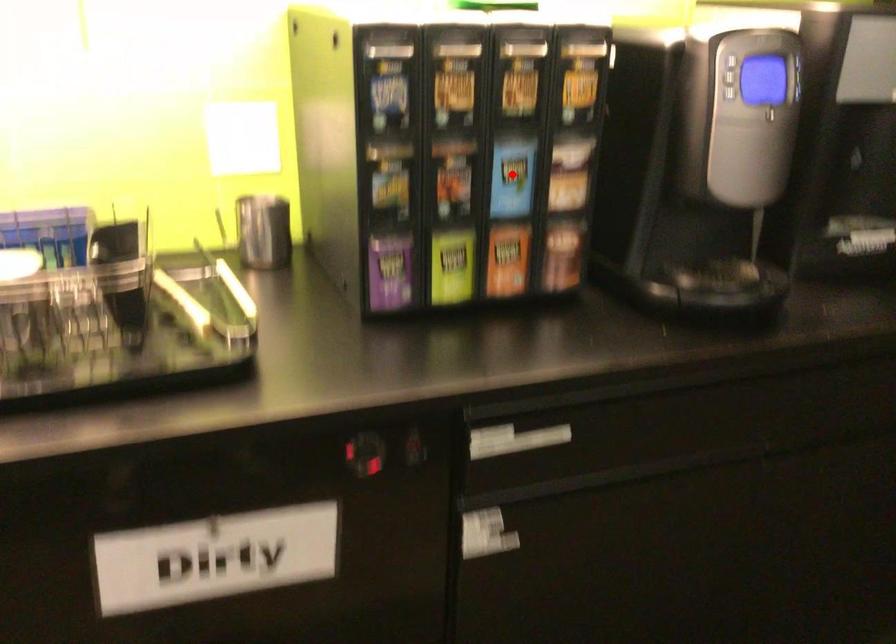
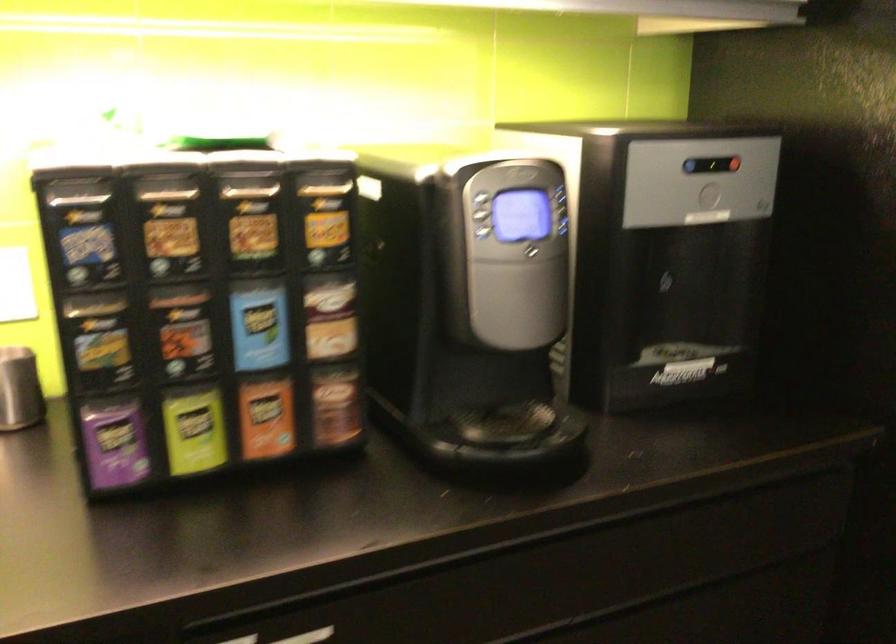
Locate, in the second image, the point that corresponds to the highlighted location in the first image.

(259, 327)